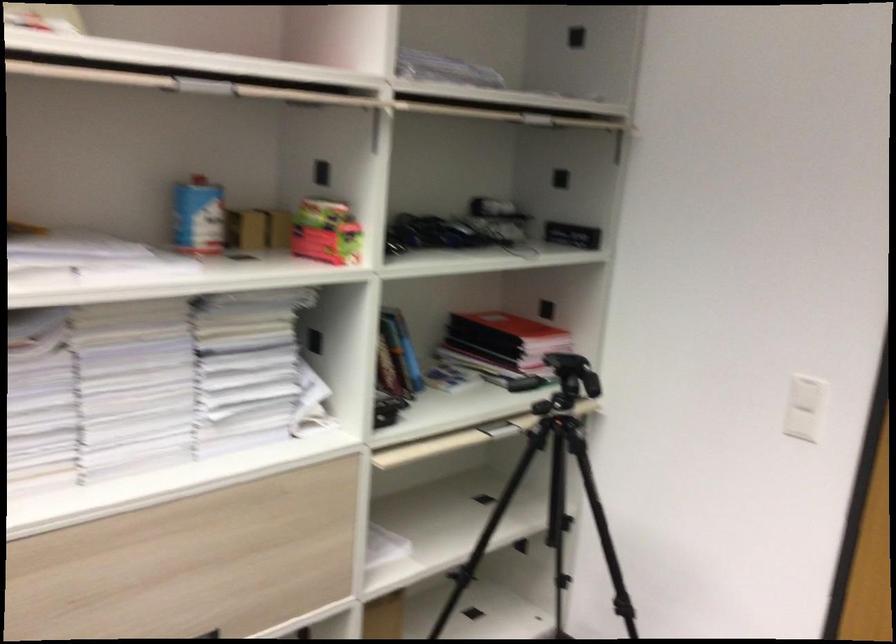
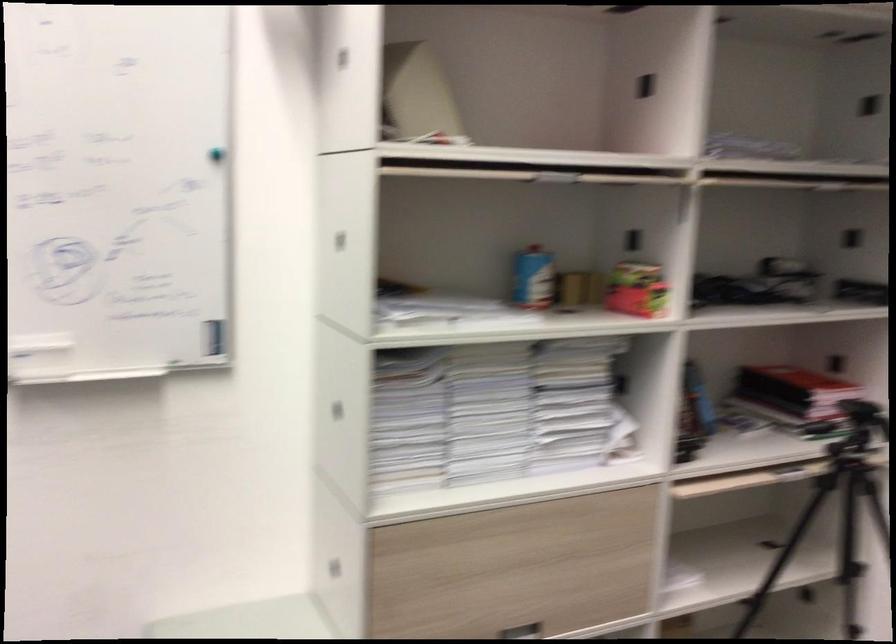
Find the pixel in the second image that matches (x=142, y=388) in the first image.

(489, 412)